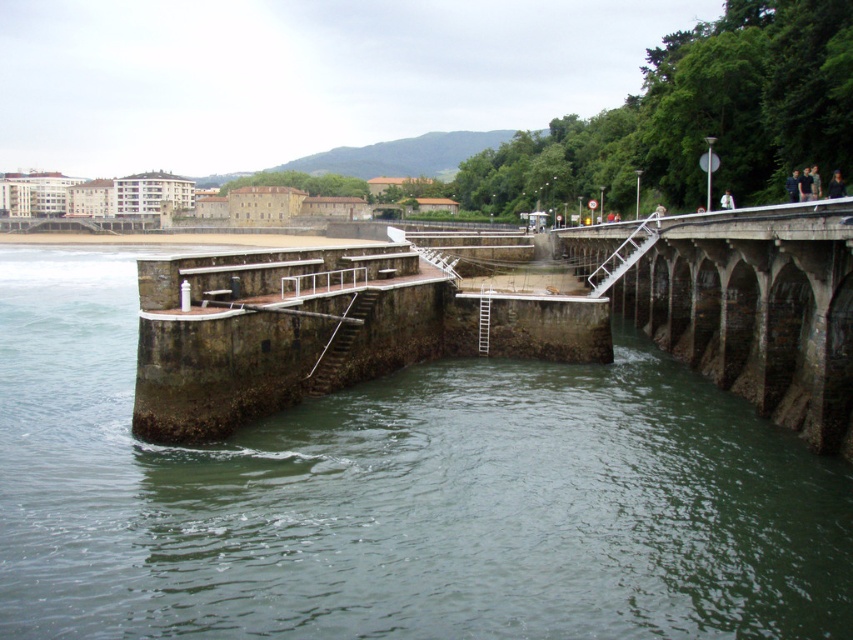
You are a maintenance worker needing to inspect both the stone bridge at center and the rusty metal stairs at center. According to the scene, which object is positioned higher and requires you to climb up to reach it?

The stone bridge at center is located above the rusty metal stairs at center, so you need to climb up to reach the stone bridge at center.

You are standing on the stone bridge at center and want to reach the rusty metal stairs at center. Which direction should you move to get there?

Since the stone bridge at center is positioned on the right side of the rusty metal stairs at center, you should move to the left to reach the rusty metal stairs at center from the stone bridge at center.

You are a tourist standing on the pier and want to take a photo of the rusty metal stairs at center and the dark blue fabric jacket at upper right. Which object should you focus on first to ensure both are in the frame?

You should focus on the rusty metal stairs at center first because it is closer to you than the dark blue fabric jacket at upper right, so it will be in the foreground and help frame both objects together.